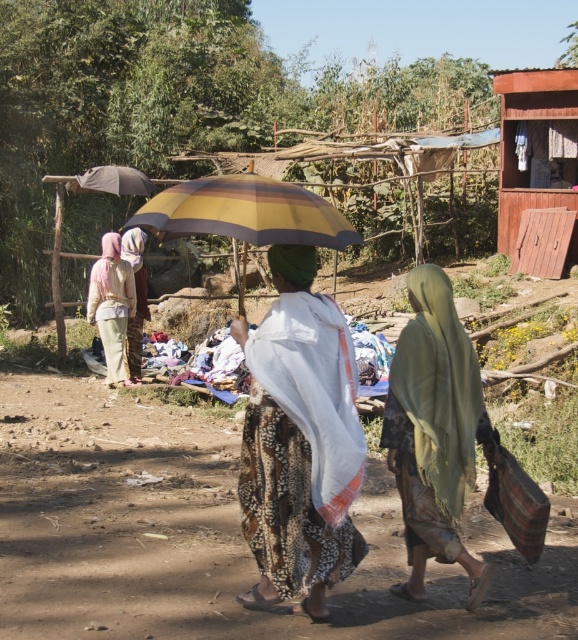
Question: Which is farther from the yellow striped fabric umbrella at center?

Choices:
 (A) green sheer scarf at center
 (B) light pink fabric at left
 (C) patterned fabric dress at center

Answer: (B)

Question: From the image, what is the correct spatial relationship of green sheer scarf at center in relation to brown wooden shelter at upper right?

Choices:
 (A) left
 (B) right

Answer: (A)

Question: Can you confirm if brown wooden shelter at upper right is bigger than light pink fabric at left?

Choices:
 (A) no
 (B) yes

Answer: (B)

Question: Which object is farther from the camera taking this photo?

Choices:
 (A) yellow striped fabric umbrella at center
 (B) brown wooden shelter at upper right

Answer: (B)

Question: Is yellow striped fabric umbrella at center above light pink fabric at left?

Choices:
 (A) yes
 (B) no

Answer: (A)

Question: Which of the following is the closest to the observer?

Choices:
 (A) green sheer scarf at center
 (B) brown wooden shelter at upper right
 (C) brown dirt field at center
 (D) yellow striped fabric umbrella at center

Answer: (D)